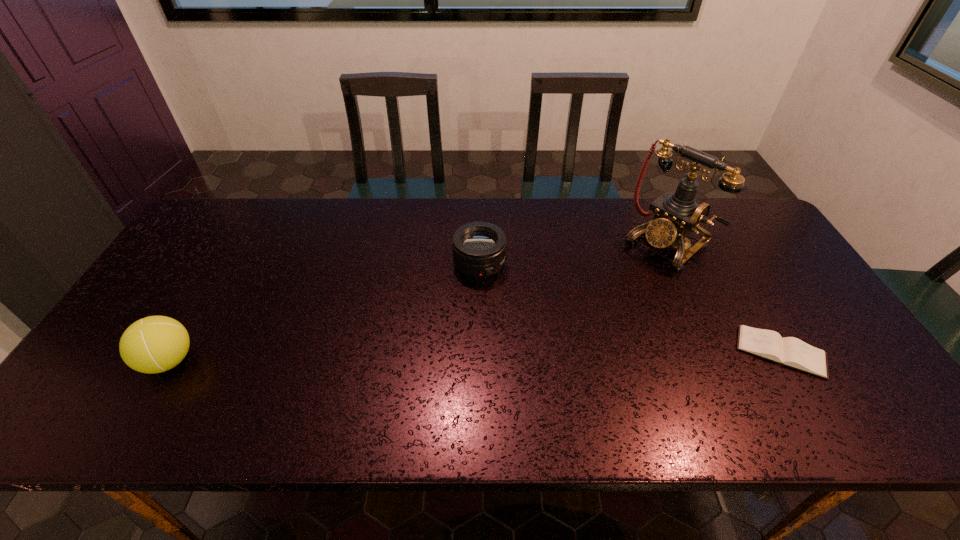
Locate an element on the screen. vacant point that satisfies the following two spatial constraints: 1. on the back side of the leftmost object; 2. on the right side of the diary is located at coordinates (175, 352).